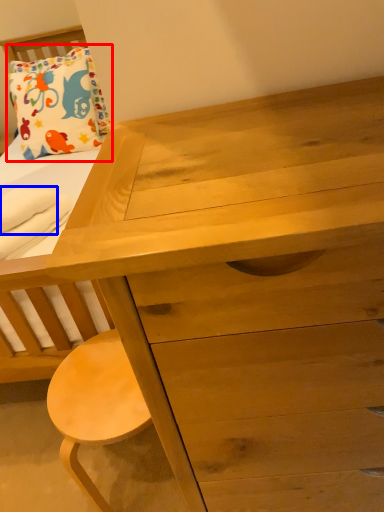
Question: Which object is further to the camera taking this photo, pillow (highlighted by a red box) or cloth (highlighted by a blue box)?

Choices:
 (A) pillow
 (B) cloth

Answer: (A)